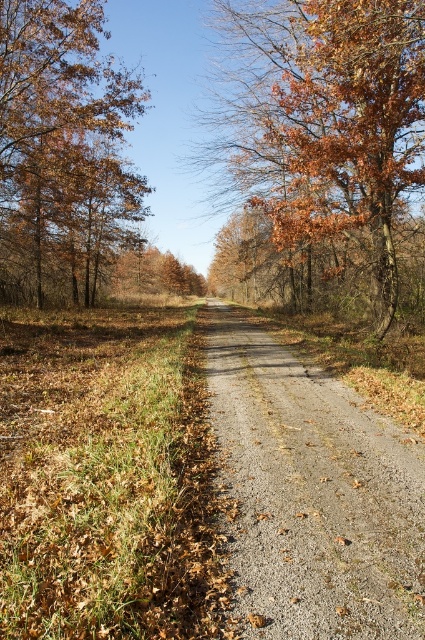
You are a hiker walking along the unpaved road in the autumn scene. You notice the brown textured leaves at center and the brown matte tree at upper left. Which object is closer to the ground?

The brown textured leaves at center is positioned under the brown matte tree at upper left, so it is closer to the ground.

You are driving a car that is 2 meters wide. You come across a narrow section of the road in the image. Can your car safely pass through the gray gravel road at center without crossing into the brown textured leaves at center?

The gray gravel road at center is thinner than brown textured leaves at center, so the road is narrower than the leaves area. Since the car is 2 meters wide, it might not fit within the narrower road section. The driver should proceed with caution or look for a wider path.

You are driving a car that is 2 meters wide. You come across the gray gravel road at center and the brown matte tree at upper left. Which path can accommodate your car without needing to adjust your driving path?

The gray gravel road at center has a lesser width compared to brown matte tree at upper left, so the brown matte tree at upper left is wider and can accommodate the car without needing to adjust the driving path.